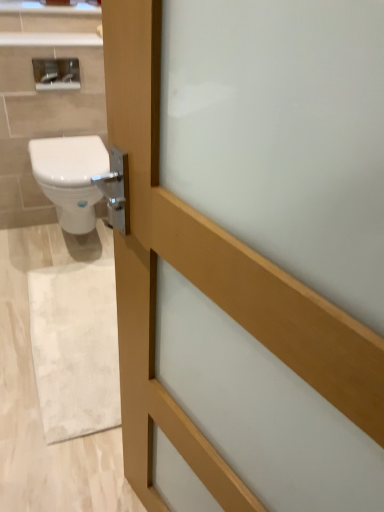
Question: Can you confirm if white marble rug at lower left is taller than satin silver mirror at upper left?

Choices:
 (A) yes
 (B) no

Answer: (B)

Question: From the image's perspective, is white marble rug at lower left over satin silver mirror at upper left?

Choices:
 (A) yes
 (B) no

Answer: (B)

Question: Does white marble rug at lower left touch satin silver mirror at upper left?

Choices:
 (A) no
 (B) yes

Answer: (A)

Question: Considering the relative sizes of white marble rug at lower left and satin silver mirror at upper left in the image provided, is white marble rug at lower left smaller than satin silver mirror at upper left?

Choices:
 (A) yes
 (B) no

Answer: (B)

Question: Is the depth of white marble rug at lower left less than that of satin silver mirror at upper left?

Choices:
 (A) no
 (B) yes

Answer: (B)

Question: Is white glossy bidet at left in front of or behind satin silver mirror at upper left in the image?

Choices:
 (A) front
 (B) behind

Answer: (A)

Question: Would you say white glossy bidet at left is to the left or to the right of satin silver mirror at upper left in the picture?

Choices:
 (A) right
 (B) left

Answer: (A)

Question: Looking at their shapes, would you say white glossy bidet at left is wider or thinner than satin silver mirror at upper left?

Choices:
 (A) thin
 (B) wide

Answer: (B)

Question: From a real-world perspective, is white glossy bidet at left physically located above or below satin silver mirror at upper left?

Choices:
 (A) below
 (B) above

Answer: (A)

Question: Looking at their shapes, would you say satin silver mirror at upper left is wider or thinner than white glossy bidet at left?

Choices:
 (A) thin
 (B) wide

Answer: (A)

Question: Is satin silver mirror at upper left situated inside white glossy bidet at left or outside?

Choices:
 (A) inside
 (B) outside

Answer: (B)

Question: Is point (64, 72) closer or farther from the camera than point (74, 147)?

Choices:
 (A) farther
 (B) closer

Answer: (A)

Question: Is satin silver mirror at upper left in front of or behind white glossy bidet at left in the image?

Choices:
 (A) front
 (B) behind

Answer: (B)

Question: From a real-world perspective, is satin silver mirror at upper left positioned above or below white marble rug at lower left?

Choices:
 (A) above
 (B) below

Answer: (A)

Question: Considering their positions, is satin silver mirror at upper left located in front of or behind white marble rug at lower left?

Choices:
 (A) front
 (B) behind

Answer: (B)